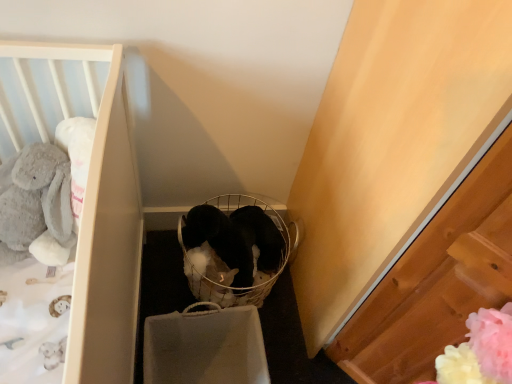
Question: Does soft gray plush rabbit at left have a lesser height compared to white crib at left?

Choices:
 (A) yes
 (B) no

Answer: (B)

Question: From the image's perspective, is soft gray plush rabbit at left on white crib at left?

Choices:
 (A) no
 (B) yes

Answer: (B)

Question: Considering the relative sizes of soft gray plush rabbit at left and white crib at left in the image provided, is soft gray plush rabbit at left thinner than white crib at left?

Choices:
 (A) no
 (B) yes

Answer: (B)

Question: From a real-world perspective, is soft gray plush rabbit at left beneath white crib at left?

Choices:
 (A) no
 (B) yes

Answer: (B)

Question: From the image's perspective, is soft gray plush rabbit at left below white crib at left?

Choices:
 (A) no
 (B) yes

Answer: (A)

Question: Can we say soft gray plush rabbit at left lies outside white crib at left?

Choices:
 (A) no
 (B) yes

Answer: (B)

Question: Can you confirm if white crib at left is smaller than soft gray plush rabbit at left?

Choices:
 (A) no
 (B) yes

Answer: (B)

Question: From the image's perspective, would you say white crib at left is shown under soft gray plush rabbit at left?

Choices:
 (A) yes
 (B) no

Answer: (A)

Question: Is white crib at left to the left of soft gray plush rabbit at left from the viewer's perspective?

Choices:
 (A) no
 (B) yes

Answer: (A)

Question: From a real-world perspective, is white crib at left located higher than soft gray plush rabbit at left?

Choices:
 (A) yes
 (B) no

Answer: (A)

Question: From a real-world perspective, is white crib at left positioned under soft gray plush rabbit at left based on gravity?

Choices:
 (A) no
 (B) yes

Answer: (A)

Question: Is white crib at left completely or partially outside of soft gray plush rabbit at left?

Choices:
 (A) yes
 (B) no

Answer: (A)

Question: Does black plush baby carriage at center have a lesser height compared to soft gray plush rabbit at left?

Choices:
 (A) yes
 (B) no

Answer: (A)